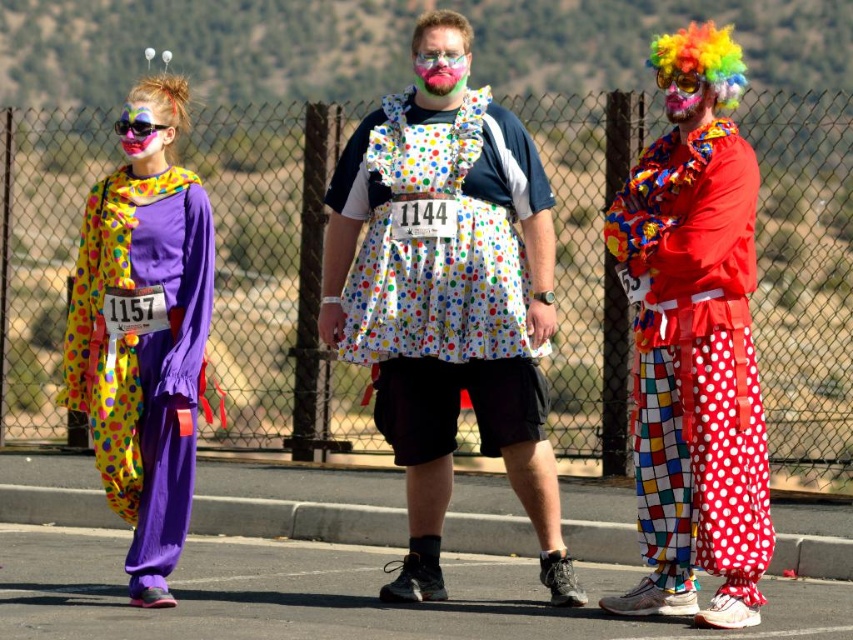
Who is more forward, (573, 145) or (672, 104)?

Point (672, 104) is more forward.

Between point (228, 305) and point (668, 116), which one is positioned in front?

Point (668, 116) is in front.

I want to click on metal mesh fence at center, so click(276, 280).

Can you confirm if polka dot fabric clown pants at right is positioned below matte clown face at left?

Correct, polka dot fabric clown pants at right is located below matte clown face at left.

Which is in front, point (656, 385) or point (138, 102)?

Positioned in front is point (656, 385).

The width and height of the screenshot is (853, 640). Describe the element at coordinates (694, 362) in the screenshot. I see `polka dot fabric clown pants at right` at that location.

Identify the location of polka dot fabric clown pants at right. (694, 362).

The height and width of the screenshot is (640, 853). I want to click on metal mesh fence at center, so click(276, 280).

Which of these two, metal mesh fence at center or pink matte goggles at center, stands taller?

metal mesh fence at center

Locate an element on the screen. metal mesh fence at center is located at coordinates (276, 280).